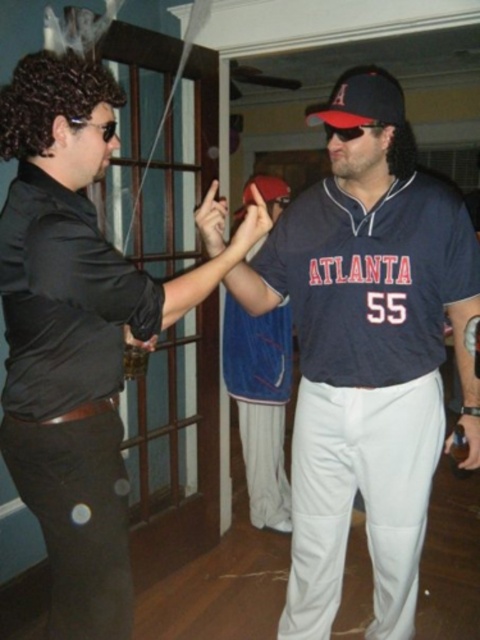
Question: Does matte black shirt at left appear over blue fabric baseball cap at center?

Choices:
 (A) no
 (B) yes

Answer: (B)

Question: Which object is positioned closest to the matte black baseball uniform at left?

Choices:
 (A) black plastic goggles at upper left
 (B) black plastic goggles at center

Answer: (A)

Question: Is navy blue jersey at center bigger than black plastic goggles at center?

Choices:
 (A) yes
 (B) no

Answer: (A)

Question: Is the position of matte black baseball uniform at left less distant than that of dark blue fabric baseball cap at center?

Choices:
 (A) yes
 (B) no

Answer: (A)

Question: Based on their relative distances, which object is nearer to the blue fabric baseball cap at center?

Choices:
 (A) matte black shirt at left
 (B) black plastic goggles at upper left
 (C) matte black baseball uniform at left
 (D) navy blue jersey at center

Answer: (D)

Question: Which object is farther from the camera taking this photo?

Choices:
 (A) red matte baseball cap at center
 (B) dark blue fabric baseball cap at center

Answer: (B)